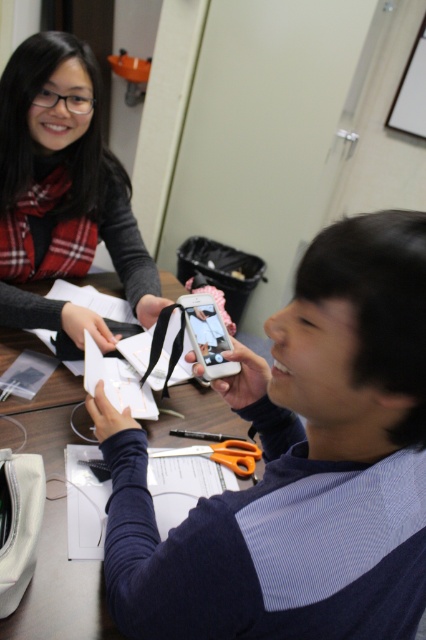
You are organizing a craft project and need to store the plaid fabric scarf at upper left and orange plastic scissors at center in a drawer. If the drawer has limited space, which item should you place first to ensure both fit?

The orange plastic scissors at center should be placed first because the plaid fabric scarf at upper left is larger in size and requires more space. By placing the smaller item first, there will be enough room left for the larger one.

You are standing at the origin of the coordinate system in the room. You need to move to point A at point (49, 195) and point B at point (238, 468). Which point is closer to you?

Point (49, 195) is behind point (238, 468), so point B at point (238, 468) is closer to you.

Consider the image. You are a photographer trying to capture a clear shot of the orange plastic scissors at center. There is a plaid fabric scarf at upper left in the way. Can you move the scarf to get a better view?

The plaid fabric scarf at upper left is further to the viewer than orange plastic scissors at center, so moving it might block the scissors more. You might need to adjust your angle instead.